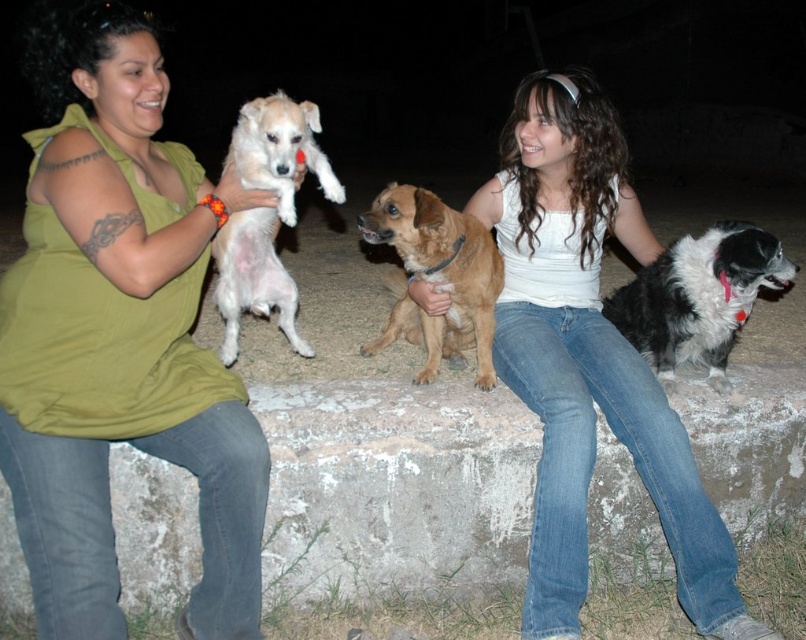
You are a photographer trying to capture a photo of the smooth concrete stone at center and the black and white fluffy dog at lower right. Which object is taller in the image?

The smooth concrete stone at center is taller than the black and white fluffy dog at lower right.

You are a photographer trying to capture a wide shot of the scene. The smooth concrete stone at center and the white fluffy dog at upper left are both in your frame. Considering their sizes, which object will appear larger in the photo?

The smooth concrete stone at center will appear larger in the photo because its width surpasses that of the white fluffy dog at upper left.